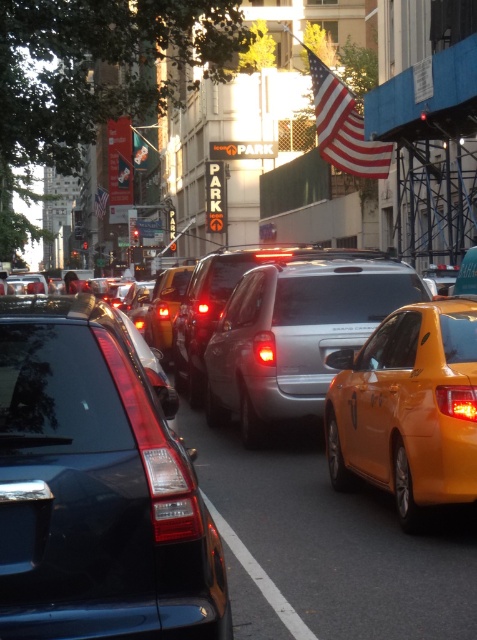
Can you confirm if orange matte taxi at right is bigger than white rubber line at center?

Yes.

Which of these two, orange matte taxi at right or white rubber line at center, stands taller?

With more height is orange matte taxi at right.

Between point (441, 452) and point (278, 588), which one is positioned behind?

The point (441, 452) is more distant.

Image resolution: width=477 pixels, height=640 pixels. I want to click on orange matte taxi at right, so 408,410.

Consider the image. How distant is orange matte taxi at right from satin silver van at center?

orange matte taxi at right and satin silver van at center are 1.95 meters apart from each other.

What do you see at coordinates (408, 410) in the screenshot?
I see `orange matte taxi at right` at bounding box center [408, 410].

Between point (416, 339) and point (269, 298), which one is positioned in front?

Positioned in front is point (416, 339).

What are the coordinates of `orange matte taxi at right` in the screenshot? It's located at (x=408, y=410).

Is glossy black sedan at left above white rubber line at center?

Indeed, glossy black sedan at left is positioned over white rubber line at center.

Can you confirm if glossy black sedan at left is bigger than white rubber line at center?

Correct, glossy black sedan at left is larger in size than white rubber line at center.

At what (x,y) coordinates should I click in order to perform the action: click on glossy black sedan at left. Please return your answer as a coordinate pair (x, y). The width and height of the screenshot is (477, 640). Looking at the image, I should click on (94, 486).